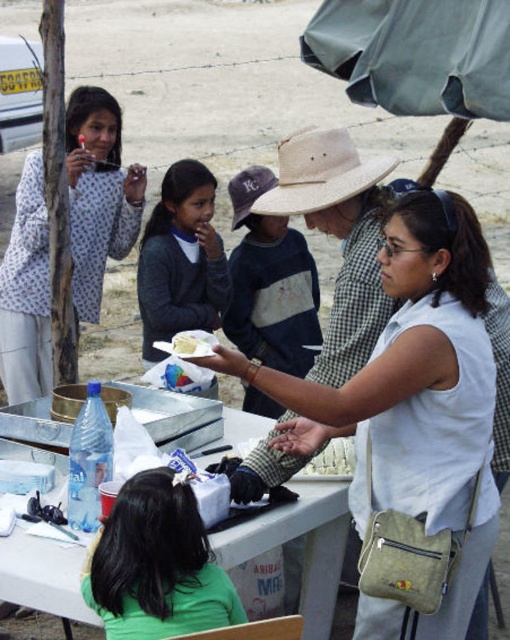
The width and height of the screenshot is (510, 640). I want to click on white plastic table at center, so click(x=301, y=545).

Does white plastic table at center have a lesser height compared to white crumbly cake at center?

→ No, white plastic table at center is not shorter than white crumbly cake at center.

Measure the distance between white plastic table at center and camera.

white plastic table at center is 7.71 feet from camera.

The image size is (510, 640). What are the coordinates of `white plastic table at center` in the screenshot? It's located at (301, 545).

Does white cotton shirt at center lie in front of floral fabric shirt at upper left?

Yes, it is in front of floral fabric shirt at upper left.

Between point (386, 292) and point (38, 340), which one is positioned behind?

Positioned behind is point (38, 340).

Is point (471, 392) positioned before point (87, 268)?

Yes, it is.

In order to click on white cotton shirt at center in this screenshot , I will do `click(399, 342)`.

Does point (471, 422) come farther from viewer compared to point (348, 440)?

No, it is not.

Does white cotton shirt at center have a lesser height compared to white crumbly cake at center?

In fact, white cotton shirt at center may be taller than white crumbly cake at center.

Which is in front, point (351, 422) or point (335, 468)?

Point (351, 422) is more forward.

Image resolution: width=510 pixels, height=640 pixels. In order to click on white cotton shirt at center in this screenshot , I will do point(399,342).